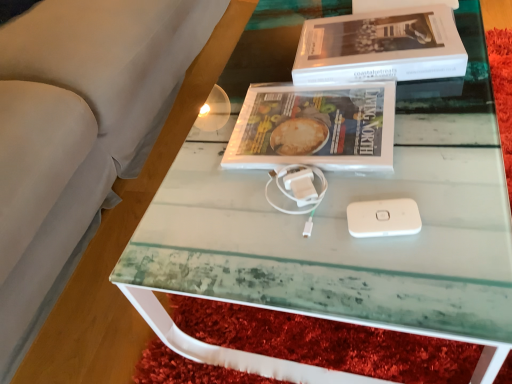
Question: Is the surface of white matte book at upper center in direct contact with matte plastic magazine at center?

Choices:
 (A) no
 (B) yes

Answer: (A)

Question: Is white matte book at upper center not close to matte plastic magazine at center?

Choices:
 (A) no
 (B) yes

Answer: (A)

Question: Considering the relative positions of white matte book at upper center and matte plastic magazine at center in the image provided, is white matte book at upper center to the right of matte plastic magazine at center from the viewer's perspective?

Choices:
 (A) yes
 (B) no

Answer: (A)

Question: From a real-world perspective, is white matte book at upper center physically below matte plastic magazine at center?

Choices:
 (A) yes
 (B) no

Answer: (B)

Question: Does white matte book at upper center lie behind matte plastic magazine at center?

Choices:
 (A) yes
 (B) no

Answer: (A)

Question: Can you confirm if white matte book at upper center is wider than matte plastic magazine at center?

Choices:
 (A) no
 (B) yes

Answer: (B)

Question: Is matte plastic magazine at center smaller than white matte book at upper center?

Choices:
 (A) no
 (B) yes

Answer: (B)

Question: Is matte plastic magazine at center at the right side of white matte book at upper center?

Choices:
 (A) yes
 (B) no

Answer: (B)

Question: Is matte plastic magazine at center in contact with white matte book at upper center?

Choices:
 (A) yes
 (B) no

Answer: (B)

Question: From a real-world perspective, is matte plastic magazine at center located higher than white matte book at upper center?

Choices:
 (A) no
 (B) yes

Answer: (A)

Question: Is matte plastic magazine at center not close to white matte book at upper center?

Choices:
 (A) yes
 (B) no

Answer: (B)

Question: Considering the relative positions of matte plastic magazine at center and white matte book at upper center in the image provided, is matte plastic magazine at center behind white matte book at upper center?

Choices:
 (A) yes
 (B) no

Answer: (B)

Question: In terms of height, does white matte book at upper center look taller or shorter compared to matte plastic magazine at center?

Choices:
 (A) tall
 (B) short

Answer: (A)